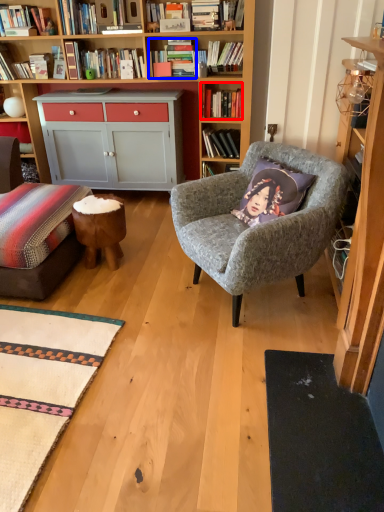
Question: Among these objects, which one is nearest to the camera, book (highlighted by a red box) or book (highlighted by a blue box)?

Choices:
 (A) book
 (B) book

Answer: (B)